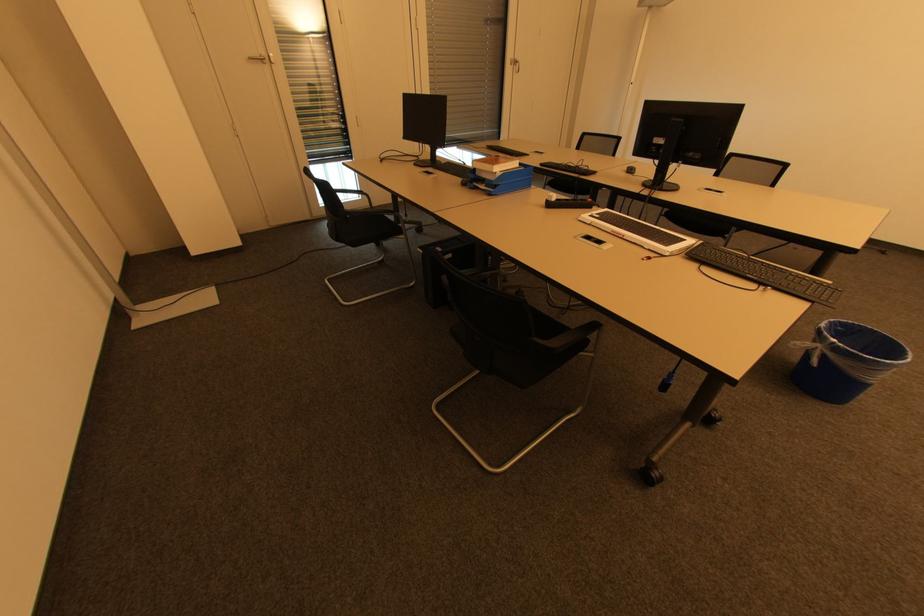
Where is `blue trash can`? The height and width of the screenshot is (616, 924). blue trash can is located at coordinates (845, 361).